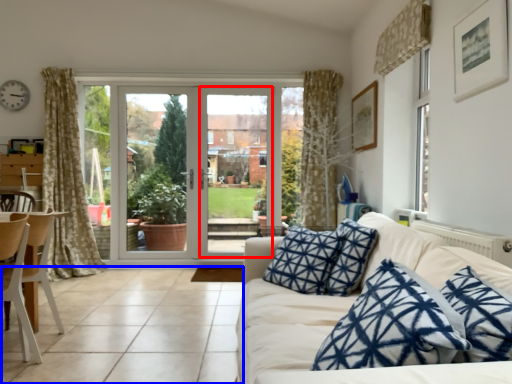
Question: Among these objects, which one is nearest to the camera, screen door (highlighted by a red box) or tile (highlighted by a blue box)?

Choices:
 (A) screen door
 (B) tile

Answer: (B)